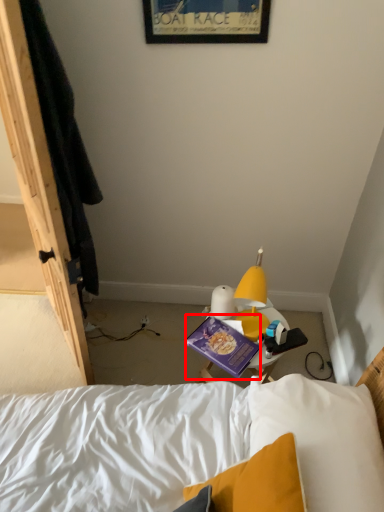
Question: From the image's perspective, considering the relative positions of paperback book (annotated by the red box) and picture frame in the image provided, where is paperback book (annotated by the red box) located with respect to the staircase?

Choices:
 (A) above
 (B) below

Answer: (B)